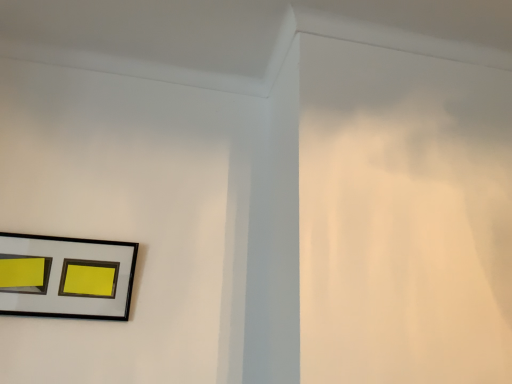
Measure the distance between matte black picture frame at lower left and camera.

matte black picture frame at lower left and camera are 3.74 feet apart from each other.

The width and height of the screenshot is (512, 384). Find the location of `matte black picture frame at lower left`. matte black picture frame at lower left is located at coordinates (69, 276).

This screenshot has width=512, height=384. Describe the element at coordinates (69, 276) in the screenshot. I see `matte black picture frame at lower left` at that location.

In order to click on matte black picture frame at lower left in this screenshot , I will do `click(69, 276)`.